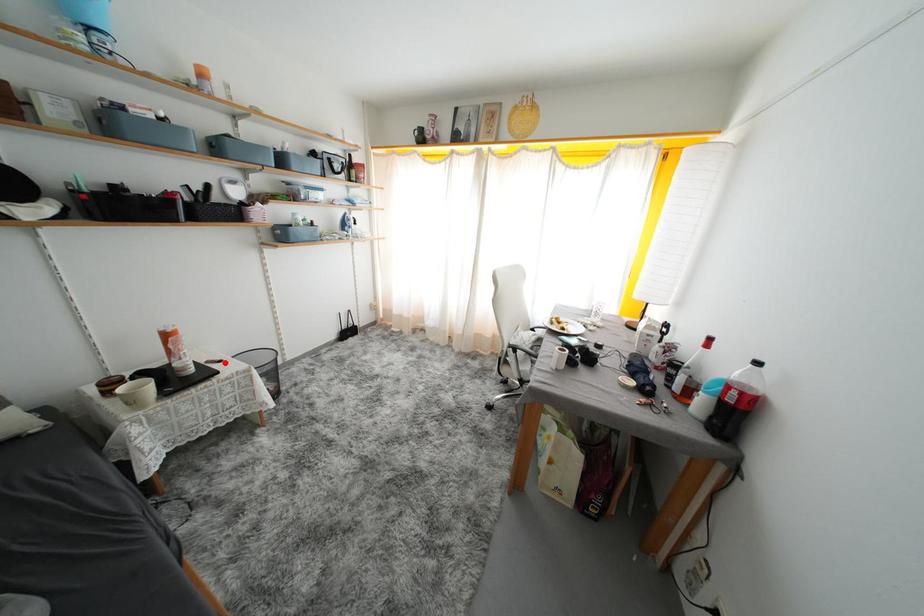
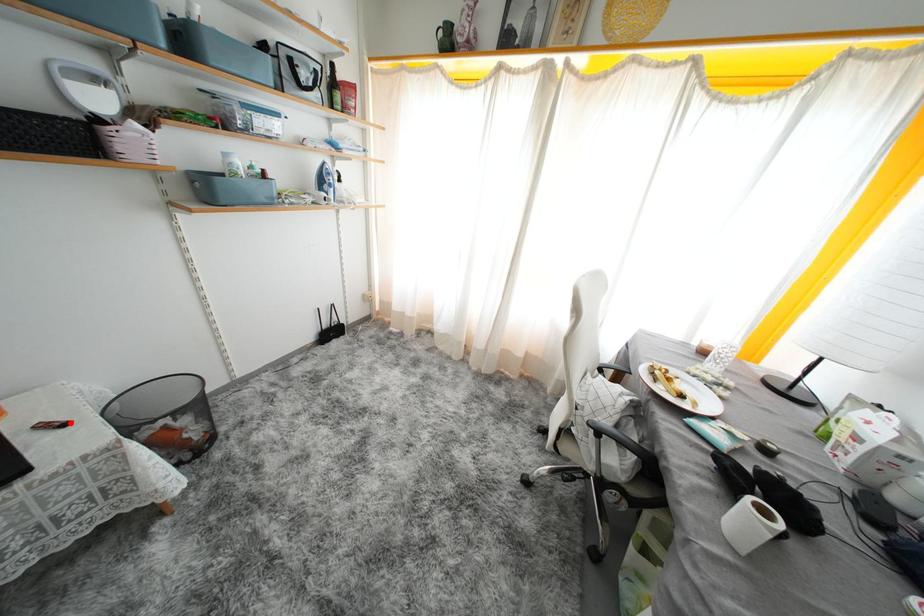
I am providing you with two images of the same scene from different viewpoints. A red point is marked on the first image and another point is marked on the second image. Do the highlighted points in image1 and image2 indicate the same real-world spot?

Yes